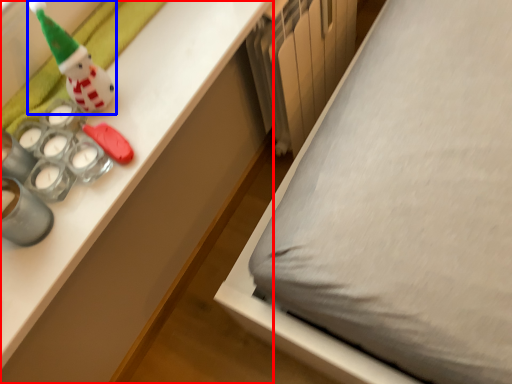
Question: Which object appears closest to the camera in this image, desk (highlighted by a red box) or toy (highlighted by a blue box)?

Choices:
 (A) desk
 (B) toy

Answer: (A)